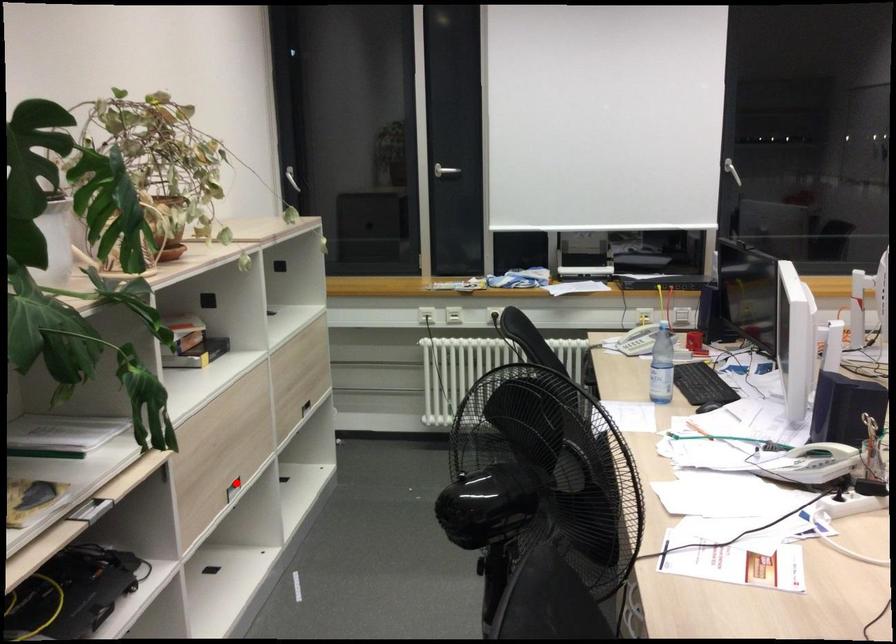
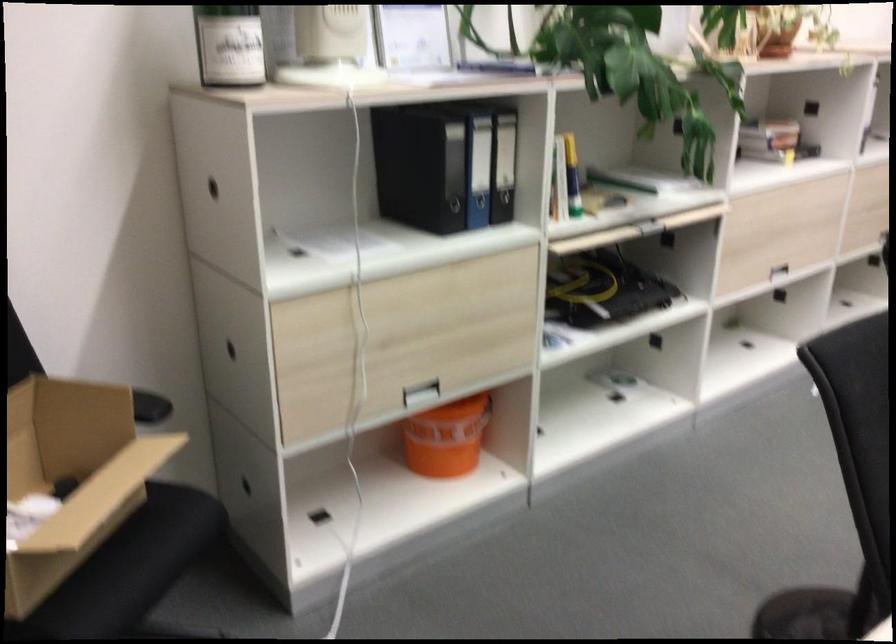
Question: I am providing you with two images of the same scene from different viewpoints. A red point is marked on the first image. Is the red point's position out of view in image 2?

Choices:
 (A) Yes
 (B) No

Answer: (B)